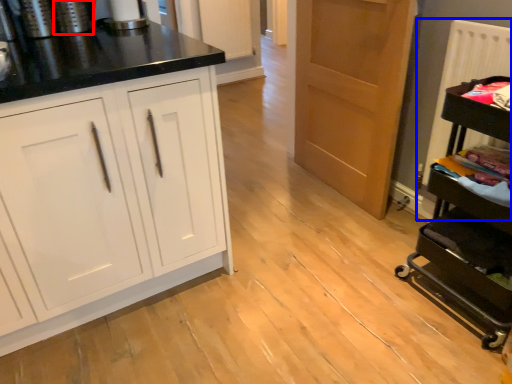
Question: Among these objects, which one is nearest to the camera, appliance (highlighted by a red box) or radiator (highlighted by a blue box)?

Choices:
 (A) appliance
 (B) radiator

Answer: (B)